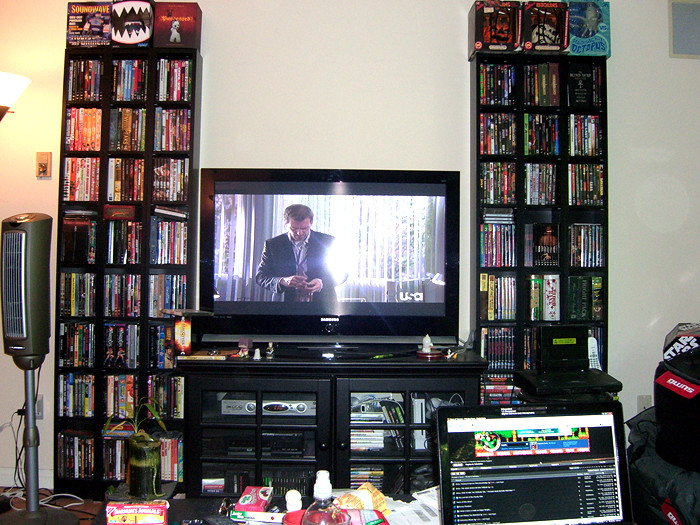
Where is `right of tv`? right of tv is located at coordinates (554, 88).